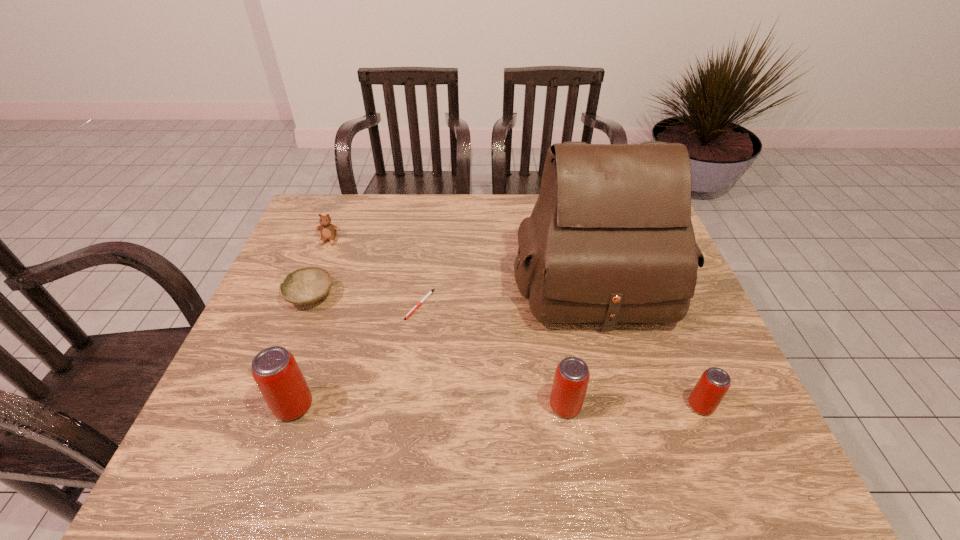
The image size is (960, 540). Find the location of `free spot between the teddy bear and the tallest object`. free spot between the teddy bear and the tallest object is located at coordinates click(x=461, y=261).

Locate an element on the screen. The height and width of the screenshot is (540, 960). vacant region between the shortest object and the teddy bear is located at coordinates (374, 272).

Image resolution: width=960 pixels, height=540 pixels. In order to click on vacant point located between the tallest object and the third shortest object in this screenshot , I will do `click(461, 261)`.

At what (x,y) coordinates should I click in order to perform the action: click on blank region between the fourth object from left to right and the fifth tallest object. Please return your answer as a coordinate pair (x, y). Looking at the image, I should click on (374, 272).

This screenshot has width=960, height=540. I want to click on unoccupied position between the fourth object from left to right and the sixth tallest object, so click(x=366, y=300).

Locate an element on the screen. The image size is (960, 540). vacant space that's between the shortest object and the second shortest object is located at coordinates (366, 300).

I want to click on unoccupied position between the bowl and the pen, so click(x=366, y=300).

The height and width of the screenshot is (540, 960). I want to click on free point between the tallest object and the teddy bear, so click(x=461, y=261).

You are a GUI agent. You are given a task and a screenshot of the screen. Output one action in this format:
    pyautogui.click(x=<x>, y=<y>)
    Task: Click on the vacant region between the second beer can from left to right and the shortest beer can
    This screenshot has height=540, width=960.
    Given the screenshot: What is the action you would take?
    pyautogui.click(x=633, y=406)

Identify the location of free spot between the shortest object and the second shortest beer can. This screenshot has height=540, width=960. (492, 355).